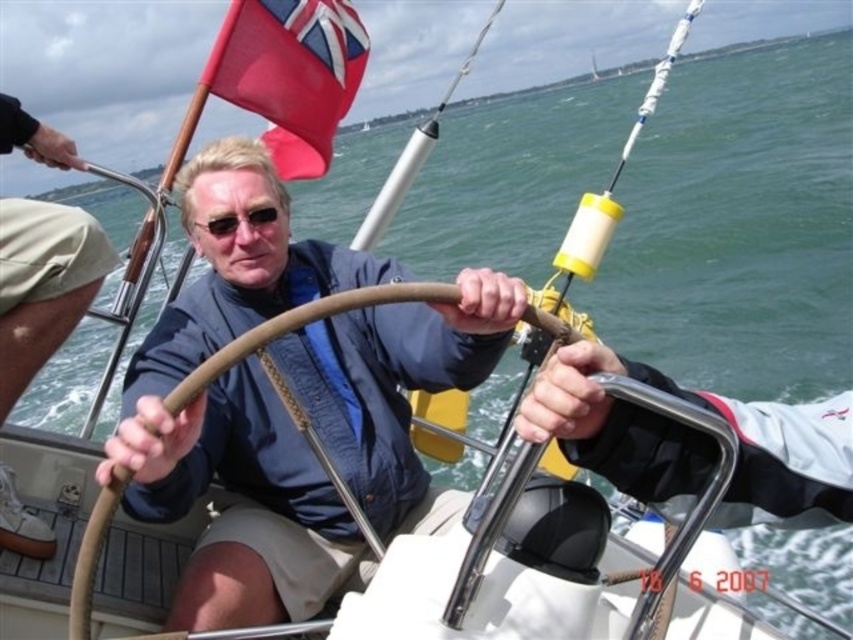
Is khaki shorts at center shorter than red fabric flag at upper left?

No.

Identify the location of khaki shorts at center. This screenshot has width=853, height=640. (44, 284).

Identify the location of khaki shorts at center. [44, 284].

In the scene shown: Can you confirm if blue fabric jacket at center is thinner than red fabric flag at upper left?

Indeed, blue fabric jacket at center has a lesser width compared to red fabric flag at upper left.

Can you confirm if blue fabric jacket at center is smaller than red fabric flag at upper left?

Yes.

Where is `blue fabric jacket at center`? The image size is (853, 640). blue fabric jacket at center is located at coordinates (238, 412).

Find the location of a particular element. The height and width of the screenshot is (640, 853). blue fabric jacket at center is located at coordinates (238, 412).

Does blue fabric jacket at center have a greater height compared to khaki shorts at center?

Incorrect, blue fabric jacket at center's height is not larger of khaki shorts at center's.

Is blue fabric jacket at center thinner than khaki shorts at center?

Correct, blue fabric jacket at center's width is less than khaki shorts at center's.

Is point (107, 456) in front of point (27, 284)?

Yes.

At what (x,y) coordinates should I click in order to perform the action: click on blue fabric jacket at center. Please return your answer as a coordinate pair (x, y). Image resolution: width=853 pixels, height=640 pixels. Looking at the image, I should click on (238, 412).